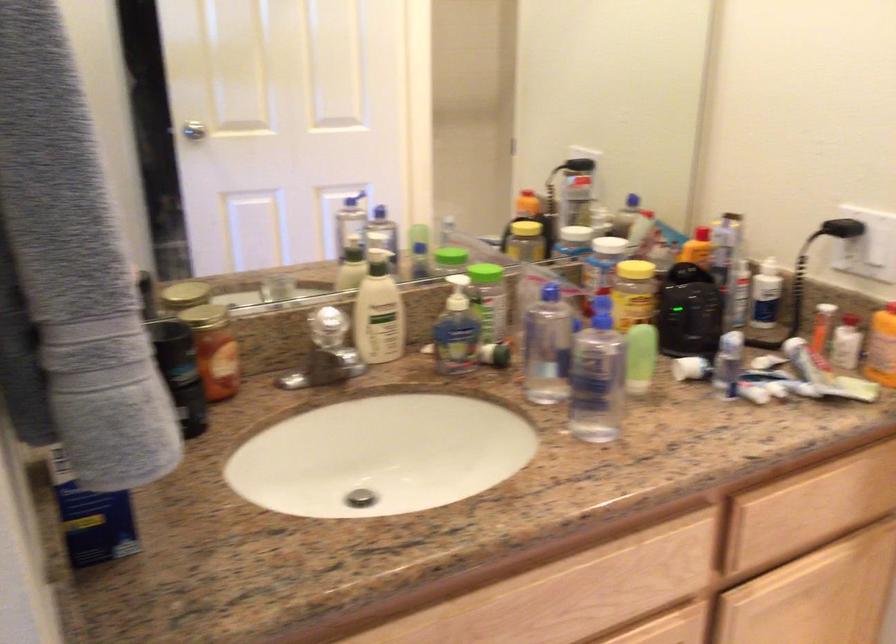
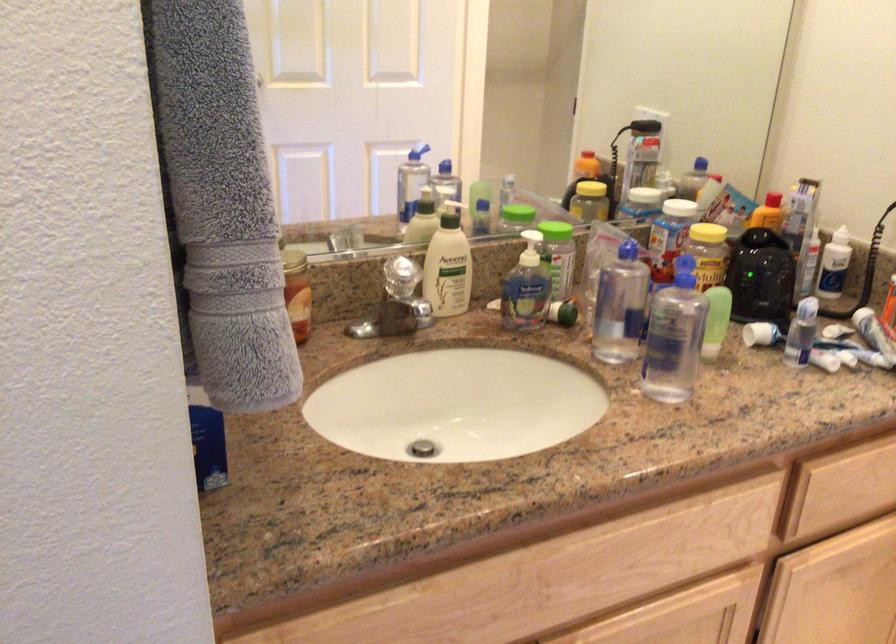
Find the pixel in the second image that matches (x=376, y=314) in the first image.

(448, 265)